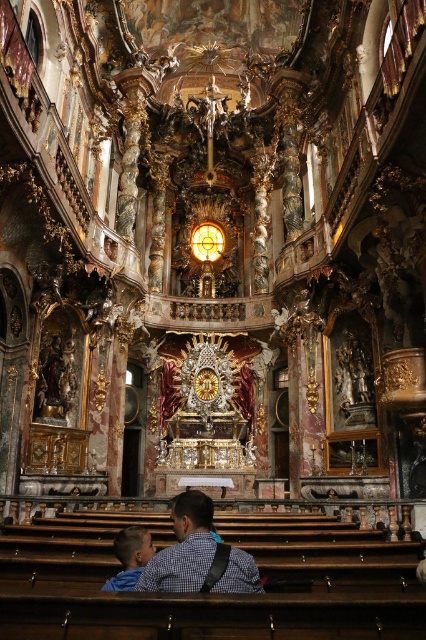
How much distance is there between checkered shirt at lower center and blue denim jacket at lower left?

checkered shirt at lower center and blue denim jacket at lower left are 3.13 meters apart from each other.

The width and height of the screenshot is (426, 640). Describe the element at coordinates (198, 556) in the screenshot. I see `checkered shirt at lower center` at that location.

This screenshot has width=426, height=640. Identify the location of checkered shirt at lower center. (198, 556).